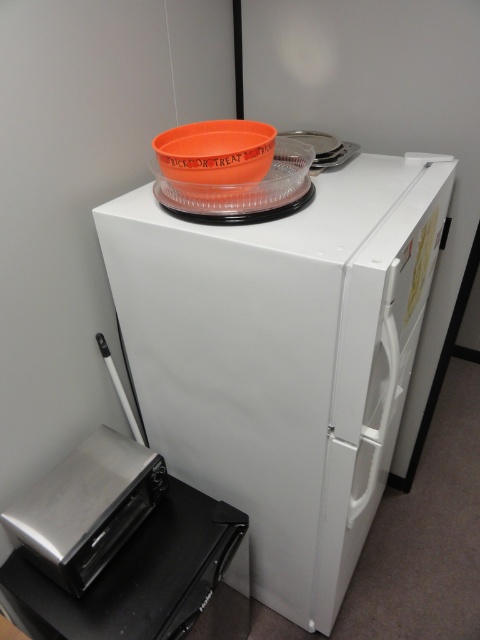
Measure the distance between white matte refrigerator at upper center and orange matte bowl at upper center.

A distance of 37.59 centimeters exists between white matte refrigerator at upper center and orange matte bowl at upper center.

Who is more distant from viewer, [327,483] or [167,147]?

Positioned behind is point [327,483].

You are a GUI agent. You are given a task and a screenshot of the screen. Output one action in this format:
    pyautogui.click(x=<x>, y=<y>)
    Task: Click on the white matte refrigerator at upper center
    
    Given the screenshot: What is the action you would take?
    pyautogui.click(x=283, y=356)

Find the location of a particular element. white matte refrigerator at upper center is located at coordinates (283, 356).